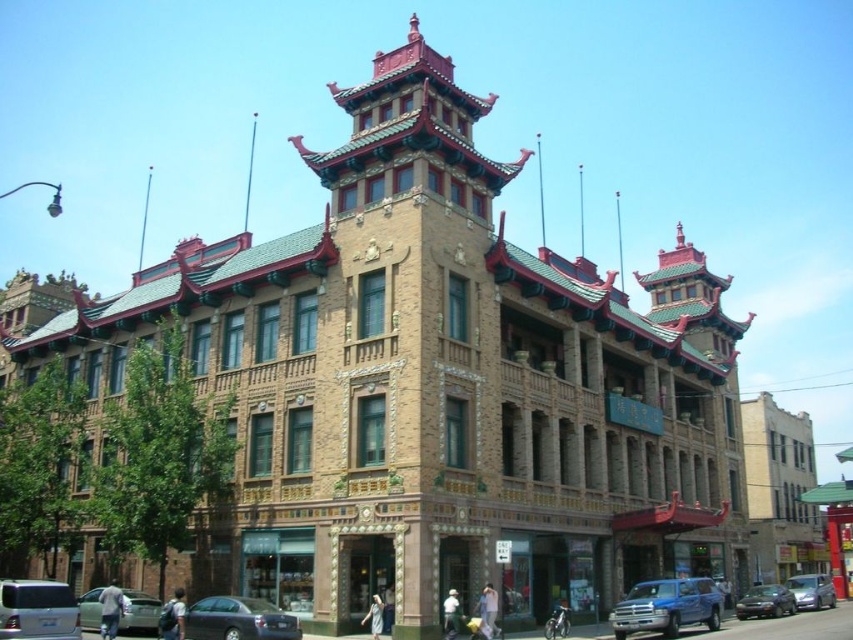
Question: Which point appears closest to the camera in this image?

Choices:
 (A) (833, 602)
 (B) (769, 602)

Answer: (B)

Question: Which object appears closest to the camera in this image?

Choices:
 (A) metallic blue car at lower right
 (B) silver metallic van at lower left
 (C) brown textured building at center
 (D) matte blue truck at lower right

Answer: (B)

Question: Considering the relative positions of silver metallic van at lower left and shiny black sedan at lower left in the image provided, where is silver metallic van at lower left located with respect to shiny black sedan at lower left?

Choices:
 (A) right
 (B) left

Answer: (B)

Question: Can you confirm if brown textured building at center is positioned below matte blue truck at lower right?

Choices:
 (A) yes
 (B) no

Answer: (B)

Question: Among these points, which one is farthest from the camera?

Choices:
 (A) (462, 115)
 (B) (705, 582)
 (C) (776, 593)
 (D) (44, 632)

Answer: (C)

Question: Can you confirm if brown textured building at center is thinner than matte blue truck at lower right?

Choices:
 (A) no
 (B) yes

Answer: (A)